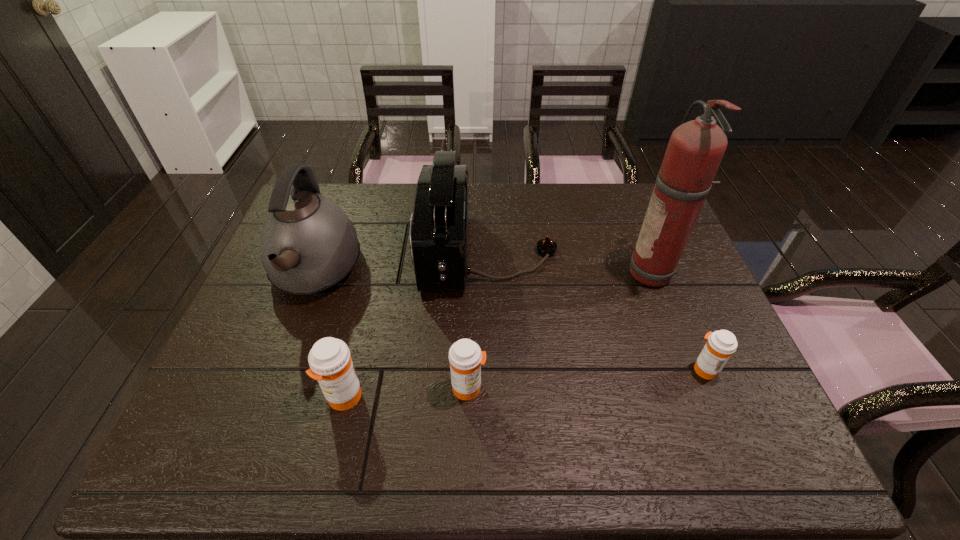
To make them evenly spaced by inserting another medicine among them, please locate a free space for this new medicine. Please provide its 2D coordinates. Your answer should be formatted as a tuple, i.e. [(x, y)], where the tuple contains the x and y coordinates of a point satisfying the conditions above.

[(588, 379)]